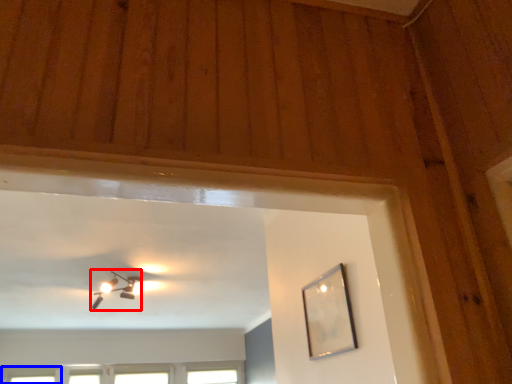
Question: Among these objects, which one is farthest to the camera, lamp (highlighted by a red box) or window (highlighted by a blue box)?

Choices:
 (A) lamp
 (B) window

Answer: (B)